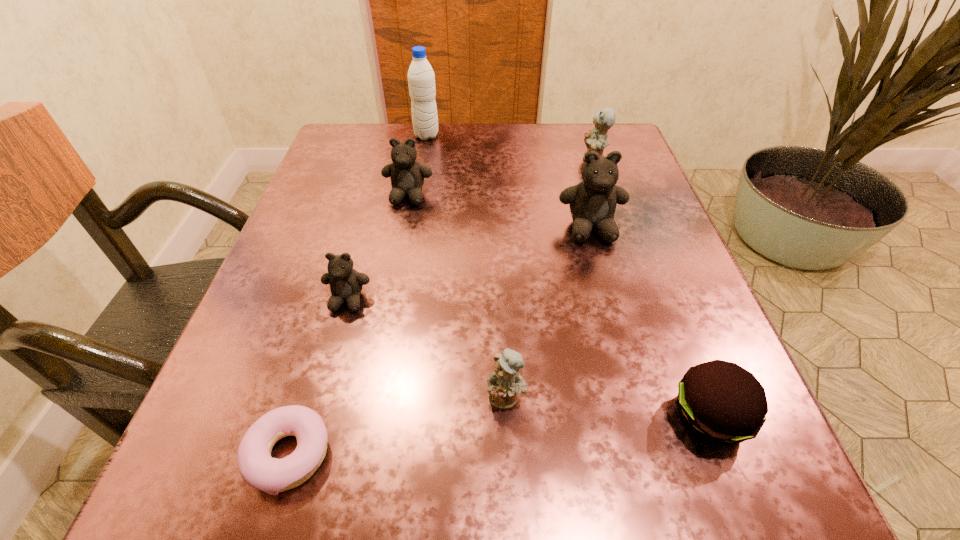
Identify the location of free space between the second farthest brown teddy bear and the patty. The image size is (960, 540). (650, 323).

I want to click on blank region between the fourth farthest teddy bear and the bigger blue teddy bear, so click(x=471, y=230).

Where is `free spot between the third farthest teddy bear and the shortest object`? The image size is (960, 540). free spot between the third farthest teddy bear and the shortest object is located at coordinates (440, 341).

Where is `free space between the nearest teddy bear and the shortest object`? free space between the nearest teddy bear and the shortest object is located at coordinates (397, 426).

Locate an element on the screen. Image resolution: width=960 pixels, height=540 pixels. vacant point located between the rightmost brown teddy bear and the fourth object from right to left is located at coordinates (548, 313).

This screenshot has width=960, height=540. Identify the location of vacant space that is in between the farthest teddy bear and the shortest object. (442, 307).

You are a GUI agent. You are given a task and a screenshot of the screen. Output one action in this format:
    pyautogui.click(x=<x>, y=<y>)
    Task: Click on the vacant area between the farther blue teddy bear and the tallest object
    The image size is (960, 540).
    Given the screenshot: What is the action you would take?
    pyautogui.click(x=511, y=147)

Find the location of `free area in between the seventh shortest object and the nearest brown teddy bear`. free area in between the seventh shortest object and the nearest brown teddy bear is located at coordinates (469, 265).

Find the location of a particular element. empty space between the farther blue teddy bear and the fourth nearest object is located at coordinates (471, 230).

Select which object appears as the fourth closest to the right blue teddy bear. Please provide its 2D coordinates. Your answer should be formatted as a tuple, i.e. [(x, y)], where the tuple contains the x and y coordinates of a point satisfying the conditions above.

[(720, 402)]